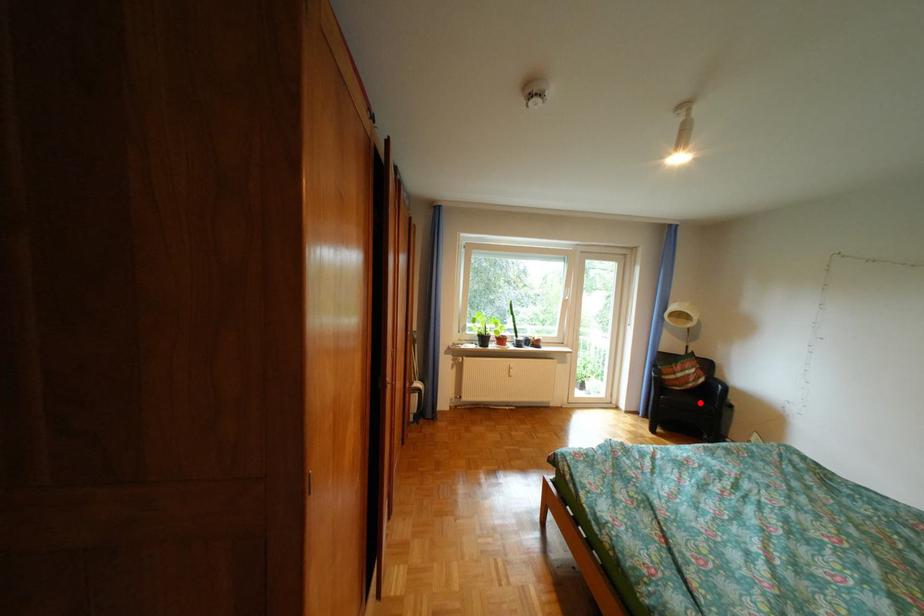
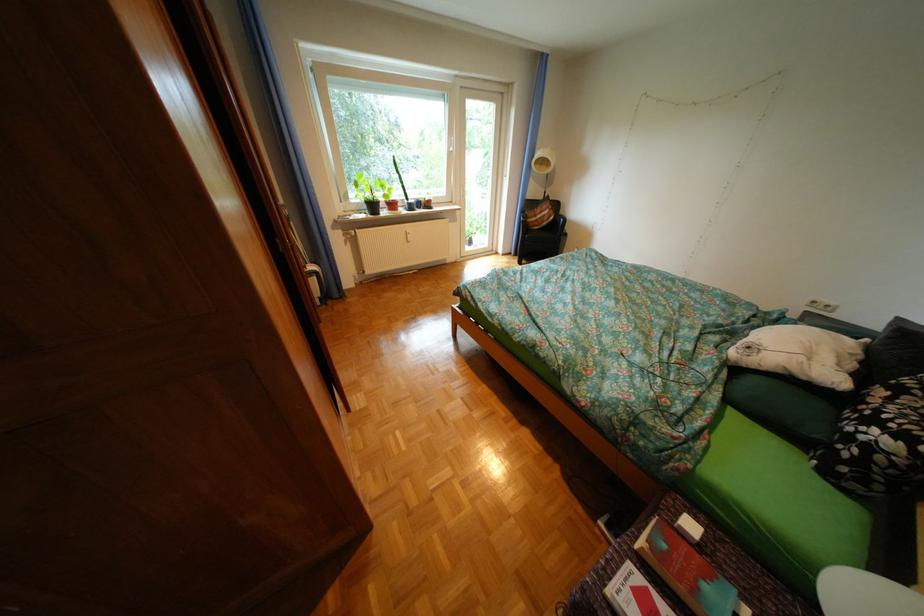
Question: A red point is marked in image1. In image2, is the corresponding 3D point closer to the camera or farther? Reply with the corresponding letter.

Choices:
 (A) The corresponding 3D point is closer.
 (B) The corresponding 3D point is farther.

Answer: (A)